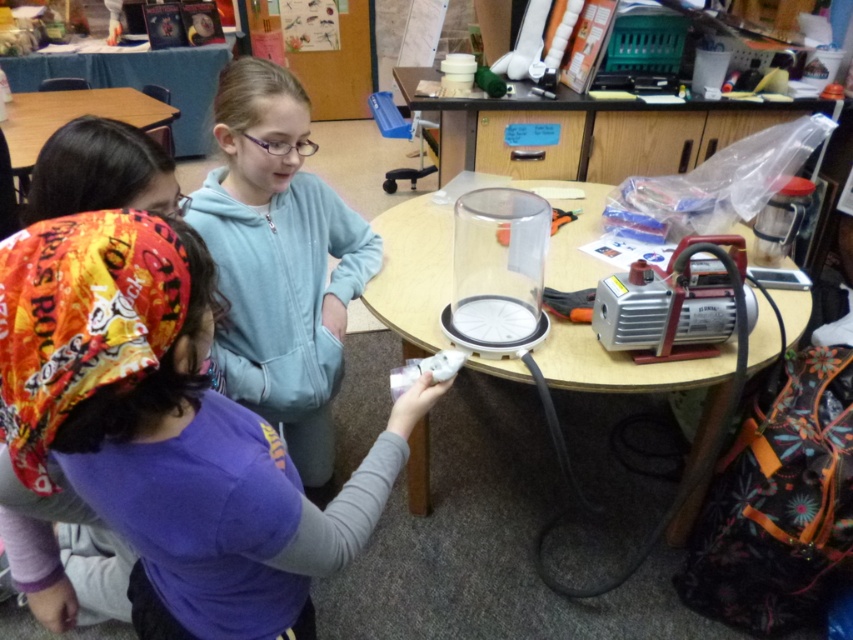
You are a student in the classroom and want to hand your game controller to the person wearing the light blue hoodie. Which object should you move first, the light blue hoodie at upper center or the white plastic game controller at lower center?

You should move the white plastic game controller at lower center first because the light blue hoodie at upper center is located below it, so moving the game controller first will allow you to access the person wearing the hoodie more easily.

Based on the scene description, where is the purple fabric shirt at lower left located in terms of coordinates?

The purple fabric shirt at lower left is located at coordinates point (170, 424).